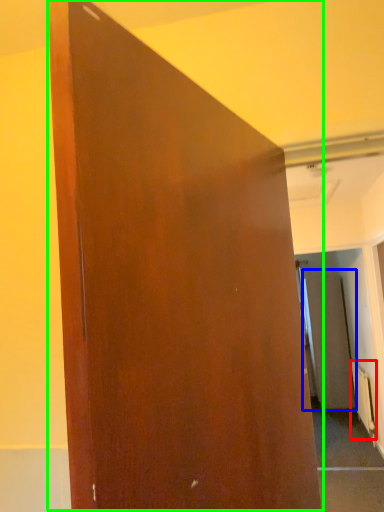
Question: Which object is the farthest from radiator (highlighted by a red box)? Choose among these: screen door (highlighted by a blue box) or door (highlighted by a green box).

Choices:
 (A) screen door
 (B) door

Answer: (B)